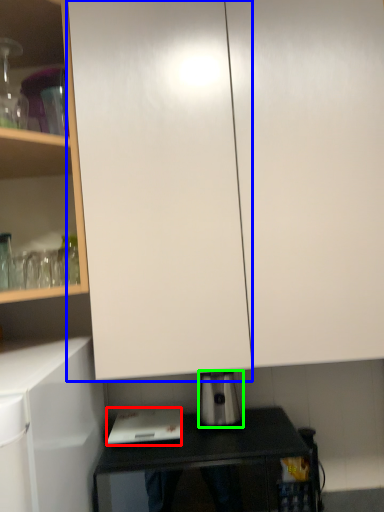
Question: Based on their relative distances, which object is nearer to home appliance (highlighted by a red box)? Choose from glass door (highlighted by a blue box) and kitchen appliance (highlighted by a green box).

Choices:
 (A) glass door
 (B) kitchen appliance

Answer: (B)